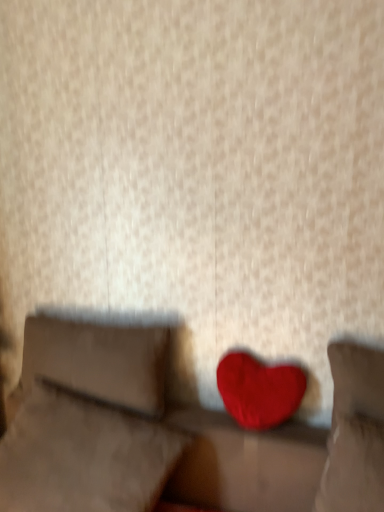
Question: Which direction should I rotate to look at velvet red heart at center, acting as the second pillow starting from the right?

Choices:
 (A) left
 (B) right

Answer: (A)

Question: Does velvet red heart at center, acting as the second pillow starting from the right, have a smaller size compared to matte red heart at center?

Choices:
 (A) yes
 (B) no

Answer: (B)

Question: From the image's perspective, is velvet red heart at center, arranged as the second pillow when viewed from the left, located above matte red heart at center?

Choices:
 (A) no
 (B) yes

Answer: (A)

Question: Is velvet red heart at center, arranged as the second pillow when viewed from the left, turned away from matte red heart at center?

Choices:
 (A) yes
 (B) no

Answer: (B)

Question: From a real-world perspective, is velvet red heart at center, acting as the second pillow starting from the right, on top of matte red heart at center?

Choices:
 (A) no
 (B) yes

Answer: (A)

Question: Does velvet red heart at center, arranged as the second pillow when viewed from the left, have a greater height compared to matte red heart at center?

Choices:
 (A) yes
 (B) no

Answer: (A)

Question: Does velvet red heart at center, acting as the second pillow starting from the right, appear on the left side of matte red heart at center?

Choices:
 (A) yes
 (B) no

Answer: (A)

Question: Is velvet red heart at center oriented towards velvet red heart at center, arranged as the second pillow when viewed from the left?

Choices:
 (A) yes
 (B) no

Answer: (A)

Question: Is velvet red heart at center smaller than velvet red heart at center, arranged as the second pillow when viewed from the left?

Choices:
 (A) no
 (B) yes

Answer: (A)

Question: From the image's perspective, is velvet red heart at center located above velvet red heart at center, acting as the second pillow starting from the right?

Choices:
 (A) yes
 (B) no

Answer: (B)

Question: Can we say velvet red heart at center lies outside velvet red heart at center, acting as the second pillow starting from the right?

Choices:
 (A) no
 (B) yes

Answer: (B)

Question: Can you see velvet red heart at center touching velvet red heart at center, arranged as the second pillow when viewed from the left?

Choices:
 (A) no
 (B) yes

Answer: (B)

Question: Is the position of velvet red heart at center more distant than that of velvet red heart at center, arranged as the second pillow when viewed from the left?

Choices:
 (A) no
 (B) yes

Answer: (A)

Question: Can you confirm if velvet red heart at center is bigger than velvet red heart at center, which ranks as the third pillow in left-to-right order?

Choices:
 (A) yes
 (B) no

Answer: (A)